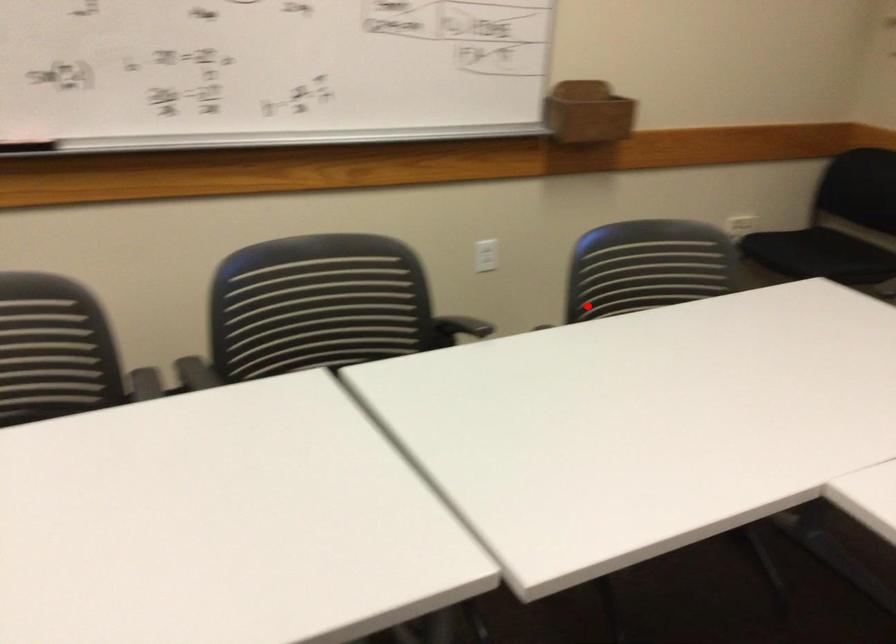
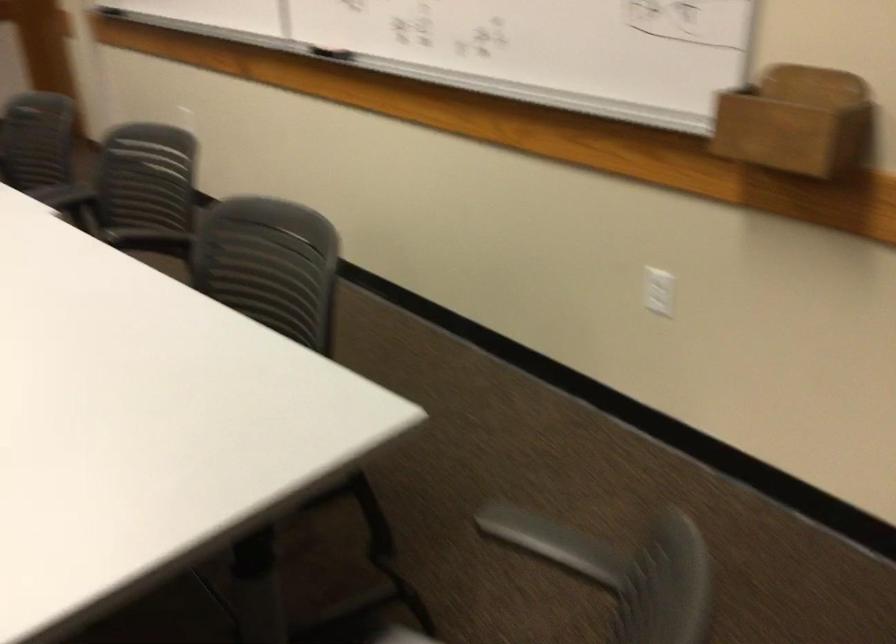
Question: A red point is marked in image1. In image2, is the corresponding 3D point closer to the camera or farther? Reply with the corresponding letter.

Choices:
 (A) The corresponding 3D point is closer.
 (B) The corresponding 3D point is farther.

Answer: (A)